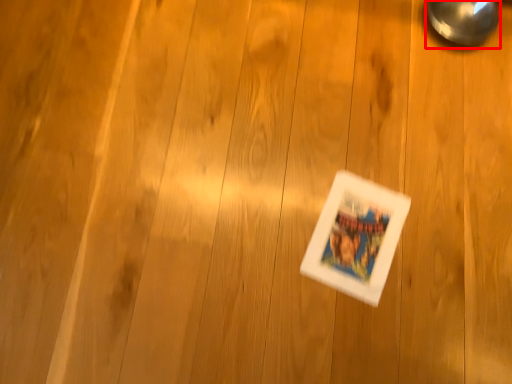
Question: From the image, what is the correct spatial relationship of magnifying glass (annotated by the red box) in relation to comic book?

Choices:
 (A) left
 (B) right

Answer: (B)